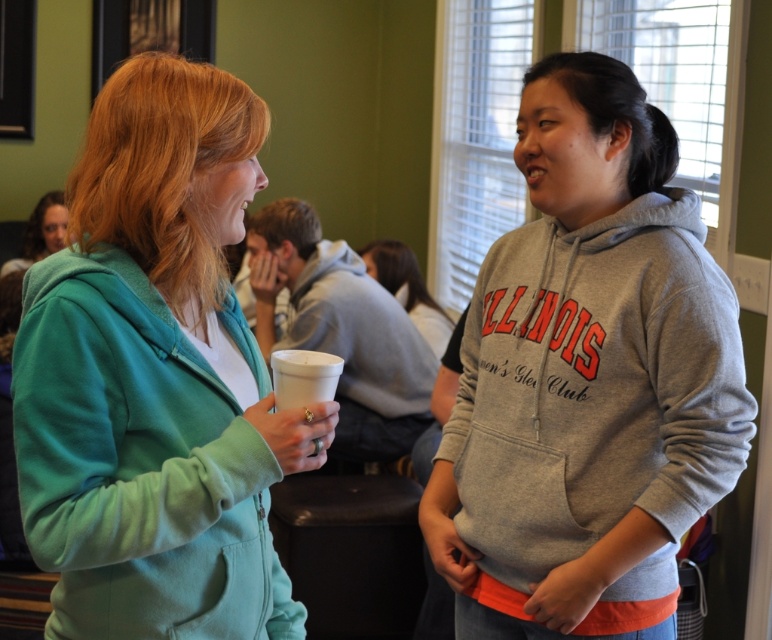
You are a photographer at the event and want to capture both the gray fleece hoodie at center and the white styrofoam cup at center in a single closeup shot. Which object should you focus on first to ensure both are in frame?

The gray fleece hoodie at center is larger than the white styrofoam cup at center, so you should focus on the gray fleece hoodie at center first to ensure both fit within the frame.